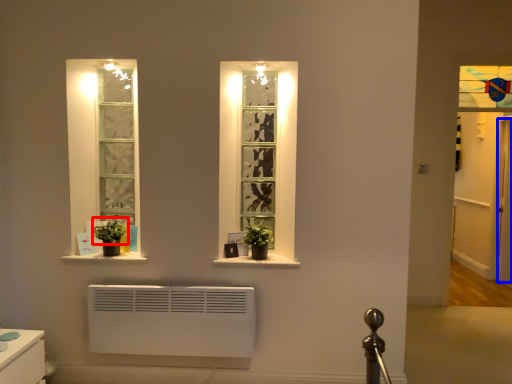
Question: Which point is further to the camera, plant (highlighted by a red box) or door (highlighted by a blue box)?

Choices:
 (A) plant
 (B) door

Answer: (B)